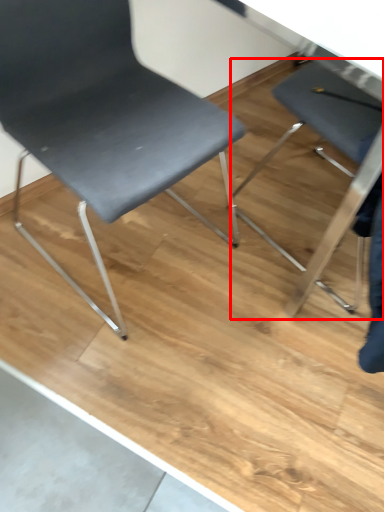
Question: Observing the image, what is the correct spatial positioning of chair (annotated by the red box) in reference to chair?

Choices:
 (A) left
 (B) right

Answer: (B)